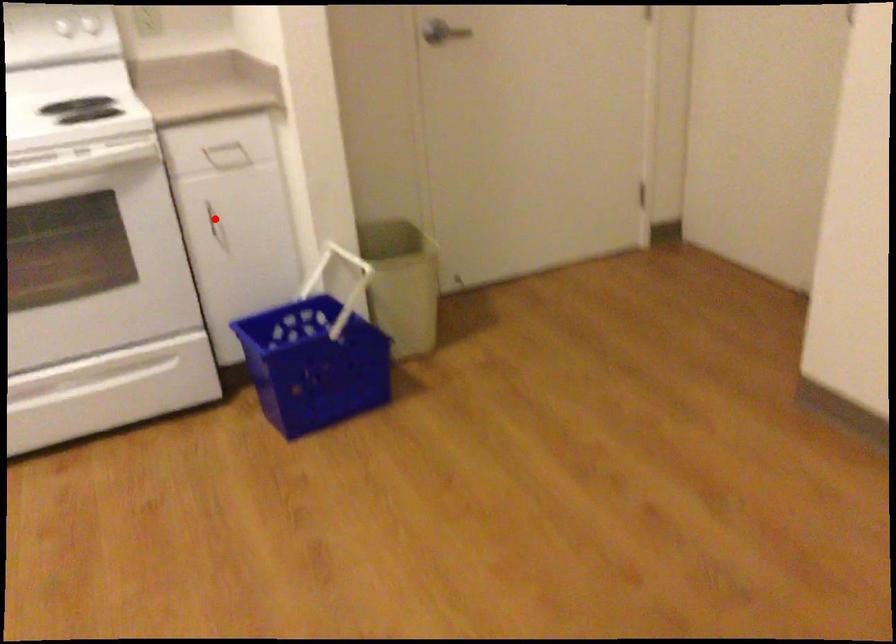
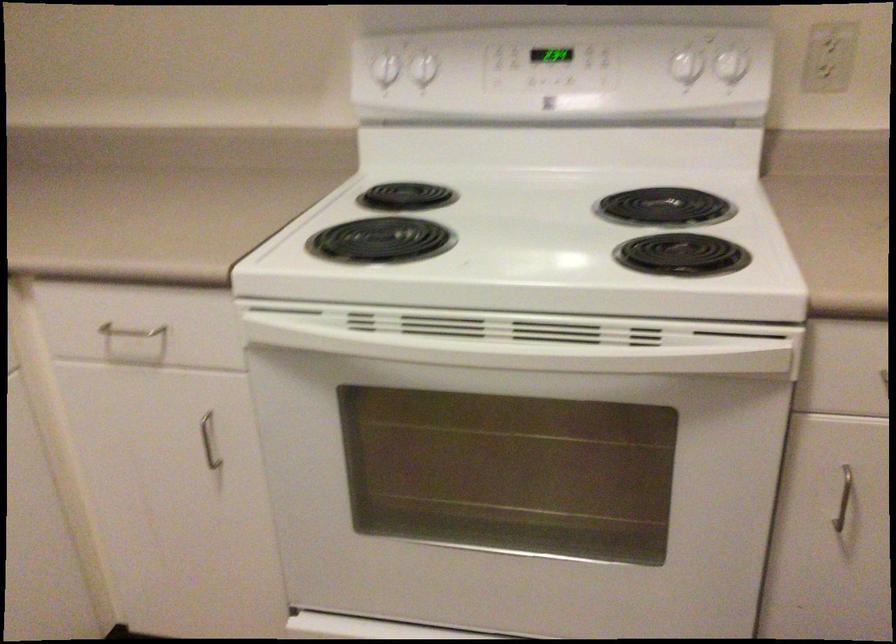
The point at the highlighted location is marked in the first image. Where is the corresponding point in the second image?

(842, 498)